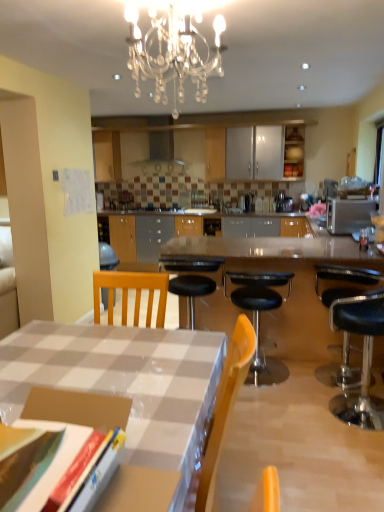
The height and width of the screenshot is (512, 384). Find the location of `free space above white glossy desk at lower left (from a real-world perspective)`. free space above white glossy desk at lower left (from a real-world perspective) is located at coordinates (92, 362).